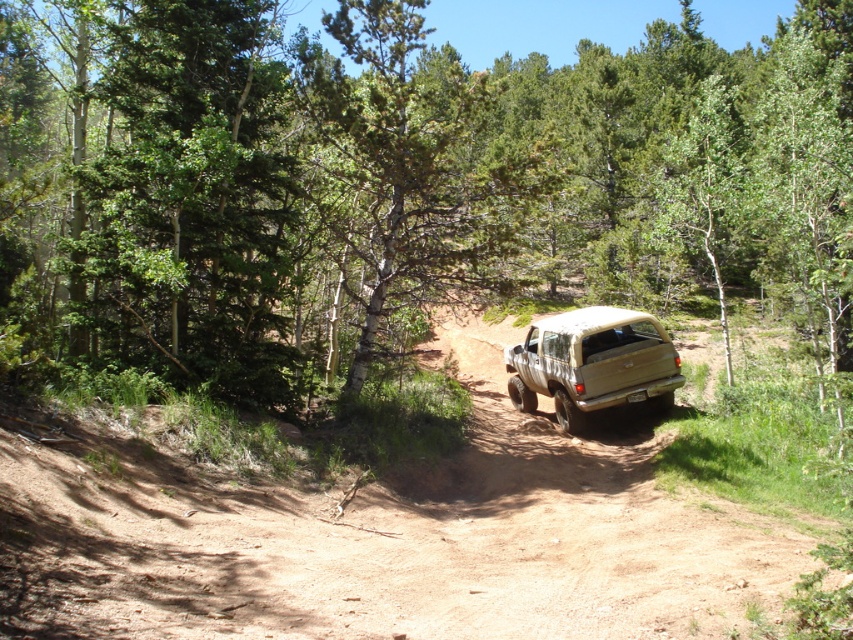
Question: Considering the real-world distances, which object is closest to the green leafy tree at center?

Choices:
 (A) brown dirt track at center
 (B) beige matte truck at center

Answer: (A)

Question: Can you confirm if green leafy tree at center is wider than brown dirt track at center?

Choices:
 (A) no
 (B) yes

Answer: (B)

Question: Which of the following is the closest to the observer?

Choices:
 (A) (572, 328)
 (B) (202, 61)
 (C) (708, 502)

Answer: (C)

Question: Which of the following is the farthest from the observer?

Choices:
 (A) (584, 369)
 (B) (566, 497)
 (C) (633, 156)

Answer: (C)

Question: Can you confirm if green leafy tree at center is wider than brown dirt track at center?

Choices:
 (A) no
 (B) yes

Answer: (B)

Question: Is green leafy tree at center thinner than beige matte truck at center?

Choices:
 (A) no
 (B) yes

Answer: (A)